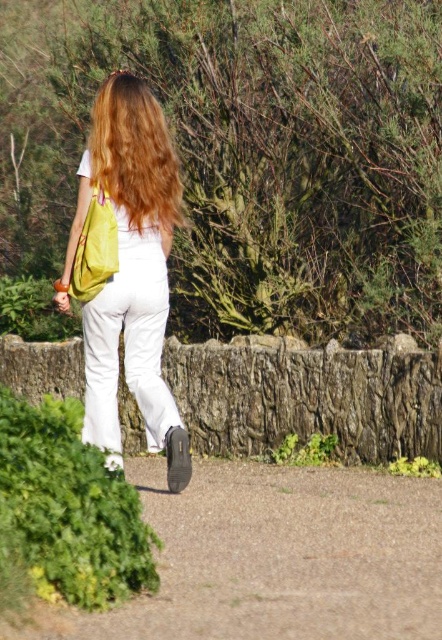
Question: Considering the relative positions of matte yellow backpack at center and shiny brown hair at upper center in the image provided, where is matte yellow backpack at center located with respect to shiny brown hair at upper center?

Choices:
 (A) below
 (B) above

Answer: (A)

Question: Can you confirm if matte yellow backpack at center is positioned to the right of shiny brown hair at upper center?

Choices:
 (A) no
 (B) yes

Answer: (A)

Question: Which of these objects is positioned farthest from the matte yellow backpack at center?

Choices:
 (A) shiny brown hair at upper center
 (B) gravel at center

Answer: (B)

Question: Which point is farther from the camera taking this photo?

Choices:
 (A) (160, 173)
 (B) (91, 216)
 (C) (423, 616)
 (D) (106, 90)

Answer: (D)

Question: Estimate the real-world distances between objects in this image. Which object is farther from the gravel at center?

Choices:
 (A) matte yellow backpack at center
 (B) shiny brown hair at upper center

Answer: (B)

Question: Does gravel at center appear on the right side of yellow fabric bag at back?

Choices:
 (A) no
 (B) yes

Answer: (B)